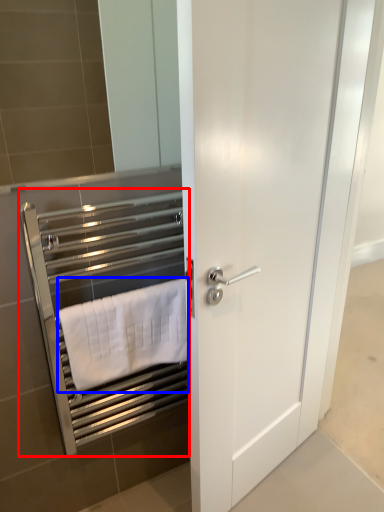
Question: Which object is closer to the camera taking this photo, closet (highlighted by a red box) or towel (highlighted by a blue box)?

Choices:
 (A) closet
 (B) towel

Answer: (A)